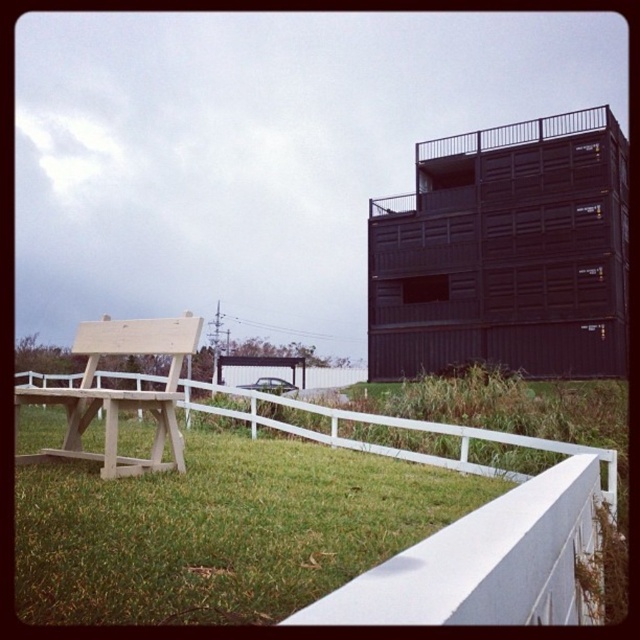
You are planning to place a small garden statue that requires a flat surface. Looking at the image, which area between the green grass at lower left and the white wooden fence at lower center would be more suitable for placing the statue?

The green grass at lower left is shorter than the white wooden fence at lower center, so the grass area would provide a flatter surface for placing the statue.

You are planning to place a small garden ornament that requires a space of at least 2 square meters. Based on the scene, which area between the green grass at lower left and the white wooden fence at lower center would be suitable?

The white wooden fence at lower center has a larger size compared to the green grass at lower left, so the white wooden fence at lower center area would be suitable for placing the garden ornament requiring at least 2 square meters.

You are planning to place a new flower pot on the green grass at lower left. However, there is a light wood park bench at left nearby. Based on the scene description, will the flower pot be visible from the picnic table? Please explain.

The green grass at lower left is positioned under the light wood park bench at left, so placing the flower pot on the grass there would likely place it underneath the bench. Since the bench is between the picnic table and the flower pot, the flower pot might not be visible from the picnic table unless viewed from a different angle or position.